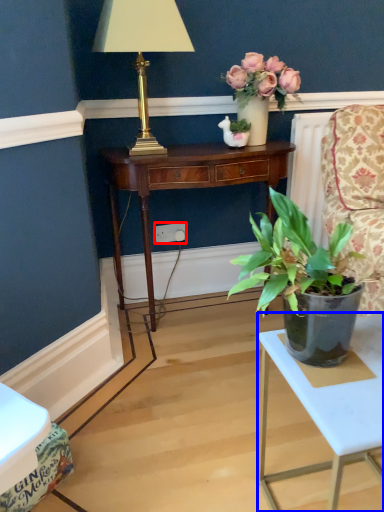
Question: Which object appears farthest to the camera in this image, power outlet (highlighted by a red box) or table (highlighted by a blue box)?

Choices:
 (A) power outlet
 (B) table

Answer: (A)